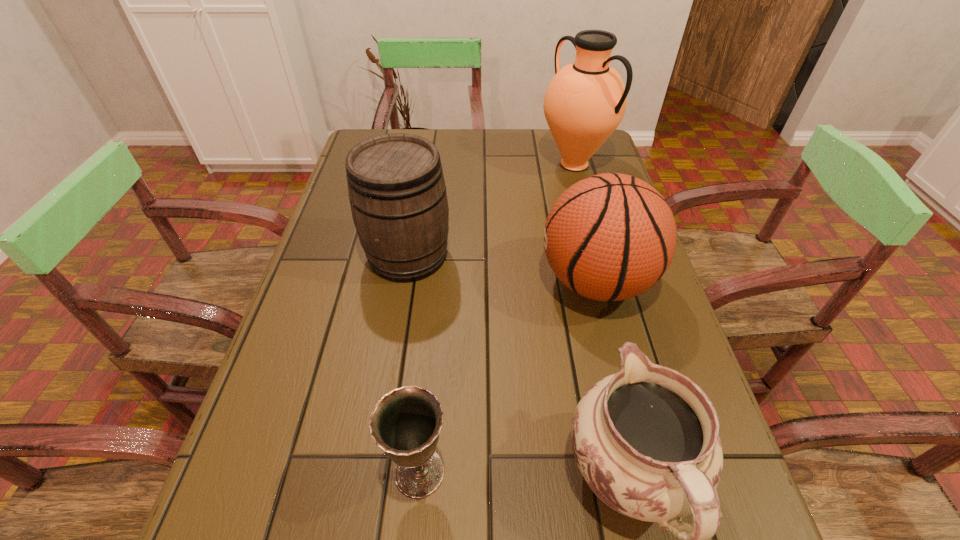
I want to click on free point between the chalice and the basketball, so click(x=508, y=377).

Locate an element on the screen. Image resolution: width=960 pixels, height=540 pixels. vacant area that lies between the basketball and the wine bucket is located at coordinates (502, 269).

At what (x,y) coordinates should I click in order to perform the action: click on unoccupied area between the taller pitcher and the chalice. Please return your answer as a coordinate pair (x, y). The image size is (960, 540). Looking at the image, I should click on (497, 318).

You are a GUI agent. You are given a task and a screenshot of the screen. Output one action in this format:
    pyautogui.click(x=<x>, y=<y>)
    Task: Click on the object that is the closest to the shorter pitcher
    The height and width of the screenshot is (540, 960).
    Given the screenshot: What is the action you would take?
    pyautogui.click(x=609, y=237)

This screenshot has height=540, width=960. I want to click on object that can be found as the fourth closest to the chalice, so click(584, 103).